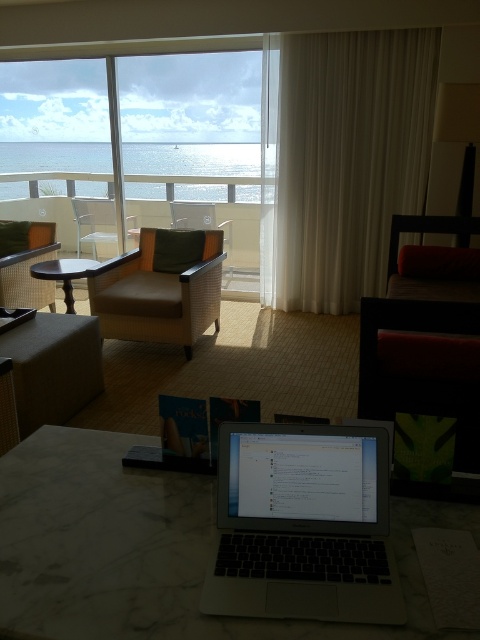
Is point (253, 42) more distant than point (160, 291)?

Yes, point (253, 42) is farther from viewer.

Is transparent glass window at upper left smaller than matte woven armchair at center?

Incorrect, transparent glass window at upper left is not smaller in size than matte woven armchair at center.

The width and height of the screenshot is (480, 640). I want to click on transparent glass window at upper left, so click(200, 150).

Can you confirm if transparent glass window at upper left is bigger than wooden table at left?

Correct, transparent glass window at upper left is larger in size than wooden table at left.

Between point (61, 195) and point (67, 262), which one is positioned in front?

Point (67, 262) is more forward.

What are the coordinates of `transparent glass window at upper left` in the screenshot? It's located at (200, 150).

Which is more to the left, transparent glass window at upper left or silver metallic laptop at center?

From the viewer's perspective, transparent glass window at upper left appears more on the left side.

Which of these two, transparent glass window at upper left or silver metallic laptop at center, stands shorter?

silver metallic laptop at center

Does point (84, 70) lie in front of point (352, 493)?

No, (84, 70) is further to viewer.

I want to click on transparent glass window at upper left, so (200, 150).